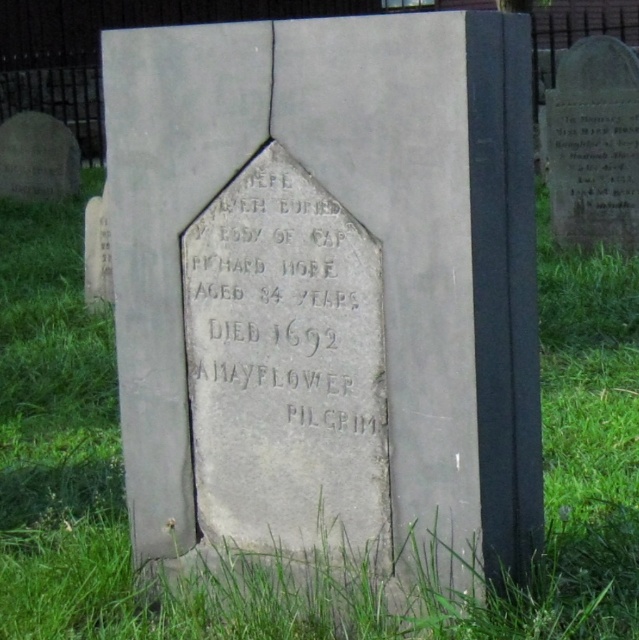
You are standing at the gray stone gravestone at upper right and want to place a wreath at the gray stone inscription at center. Given that you can reach 12 feet, can you reach the inscription without moving?

The gray stone inscription at center and gray stone gravestone at upper right are 16.16 feet apart from each other. Since you can only reach 12 feet, you cannot reach the inscription without moving closer.

You are standing in front of the gravestone and want to read the inscription clearly. The gray stone inscription at center is 2.61 meters away from you. Can you step forward to get closer to the inscription so that you can read it without straining your eyes?

The gray stone inscription at center is 2.61 meters away from the camera, so stepping forward to reduce the distance would allow you to read it more clearly.